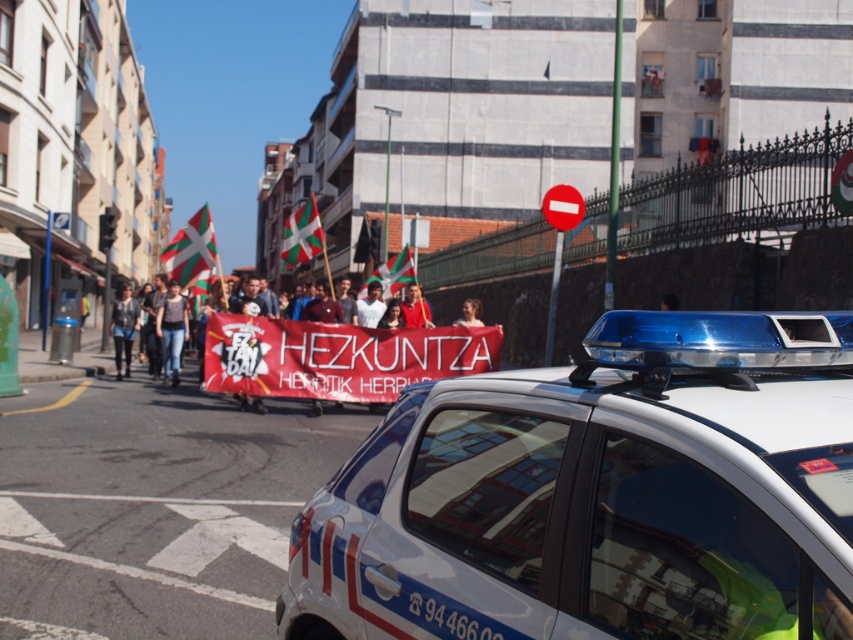
Which is in front, point (202, 250) or point (166, 368)?

Point (202, 250)

Who is more distant from viewer, [202,259] or [170,316]?

The point [170,316] is behind.

Image resolution: width=853 pixels, height=640 pixels. In order to click on red-green striped flag at left in this screenshot , I will do `click(190, 250)`.

Who is positioned more to the left, red-green striped flag at left or denim jacket at left?

red-green striped flag at left is more to the left.

From the picture: Is red-green striped flag at left in front of denim jacket at left?

Yes.

Does point (181, 284) come closer to viewer compared to point (129, 340)?

Yes, it is in front of point (129, 340).

Find the location of `red-green striped flag at left`. red-green striped flag at left is located at coordinates (190, 250).

Is white glossy police car at center shorter than matte red banner at center?

Indeed, white glossy police car at center has a lesser height compared to matte red banner at center.

Is white glossy police car at center above matte red banner at center?

Yes.

Between point (834, 522) and point (357, 342), which one is positioned in front?

Point (834, 522) is in front.

Where is `white glossy police car at center`? The width and height of the screenshot is (853, 640). white glossy police car at center is located at coordinates (599, 493).